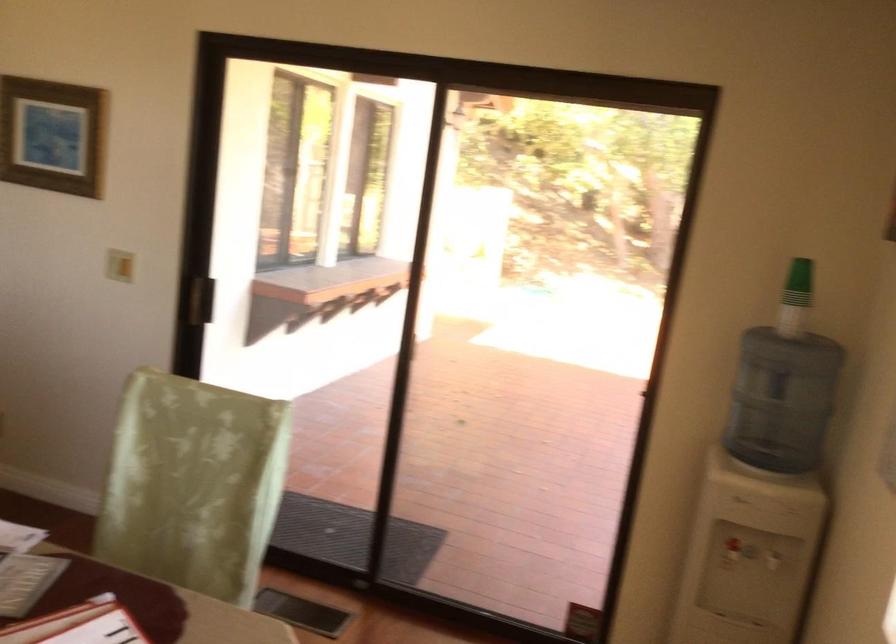
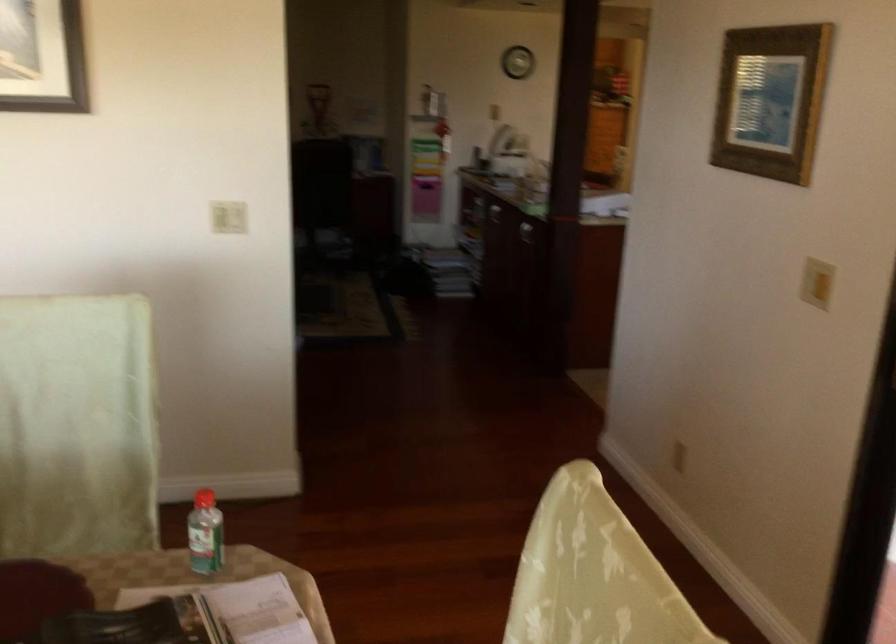
Locate, in the second image, the point that corresponds to the point at 112,249 in the first image.

(816, 283)